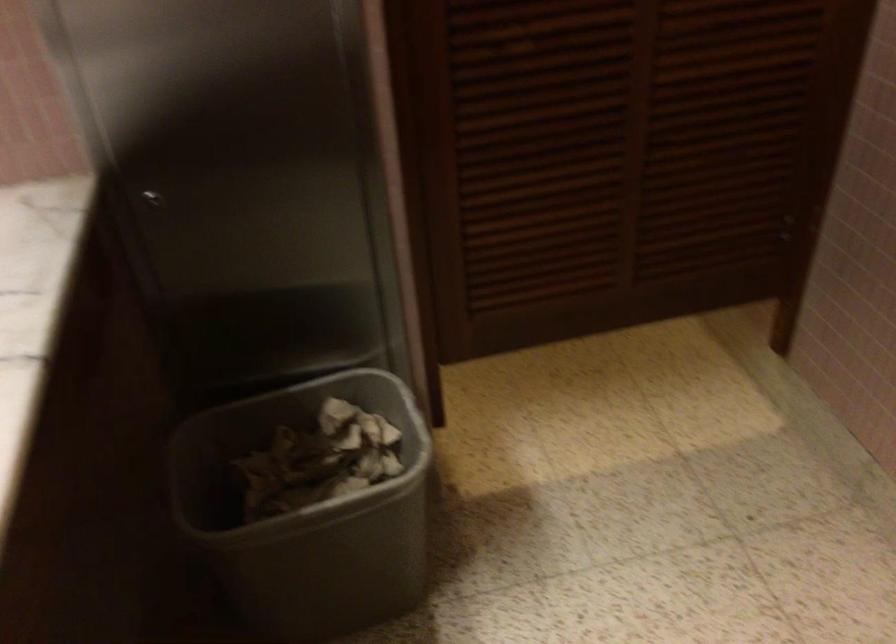
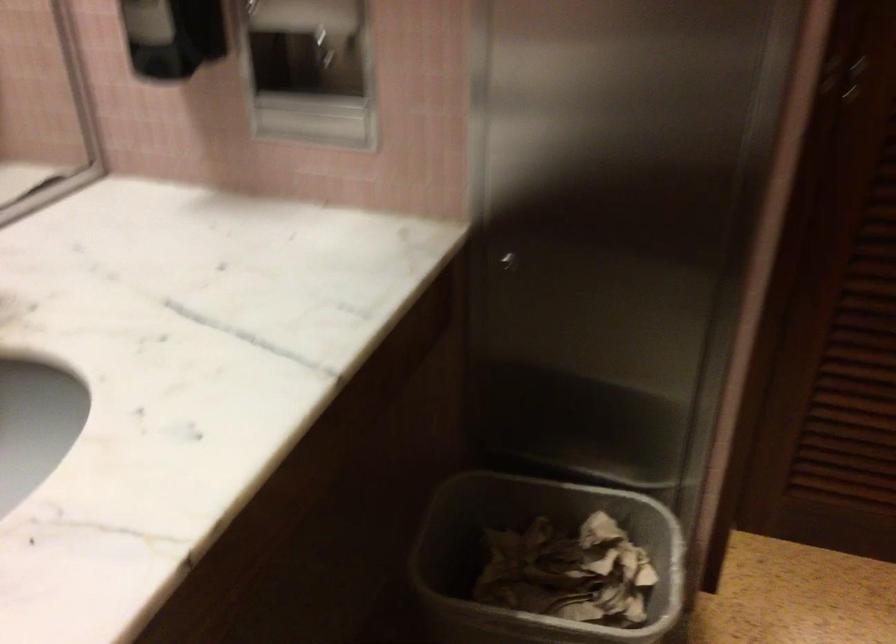
The point at (323, 466) is marked in the first image. Where is the corresponding point in the second image?

(567, 572)